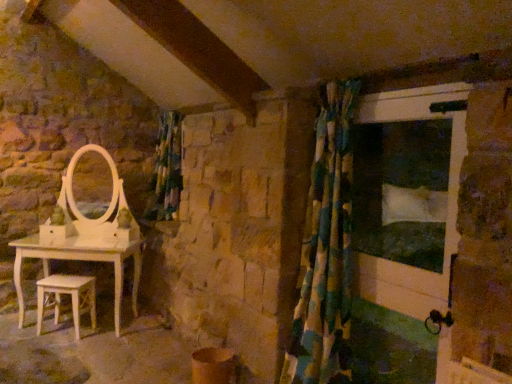
This screenshot has width=512, height=384. Describe the element at coordinates (404, 229) in the screenshot. I see `white painted wood screen door at right` at that location.

Image resolution: width=512 pixels, height=384 pixels. Find the location of `multicolored fabric shower curtain at right`. multicolored fabric shower curtain at right is located at coordinates (325, 246).

Measure the distance between white wooden stool at lower left and camera.

white wooden stool at lower left is 11.02 feet away from camera.

The image size is (512, 384). I want to click on white painted wood screen door at right, so click(x=404, y=229).

What's the angular difference between white wooden stool at lower left and white painted wood screen door at right's facing directions?

The angular difference between white wooden stool at lower left and white painted wood screen door at right is 48.2 degrees.

Is white wooden stool at lower left facing towards white painted wood screen door at right?

No, white wooden stool at lower left is not oriented towards white painted wood screen door at right.

Considering the sizes of white wooden stool at lower left and white painted wood screen door at right in the image, is white wooden stool at lower left wider or thinner than white painted wood screen door at right?

Clearly, white wooden stool at lower left has more width compared to white painted wood screen door at right.

Does white wooden stool at lower left have a smaller size compared to white painted wood screen door at right?

Yes, white wooden stool at lower left is smaller than white painted wood screen door at right.

Can you tell me how much green fabric curtain at center and white wooden stool at lower left differ in facing direction?

They differ by 48.5 degrees in their facing directions.

Between green fabric curtain at center and white wooden stool at lower left, which one has larger size?

green fabric curtain at center is bigger.

In the scene shown: Which is correct: green fabric curtain at center is inside white wooden stool at lower left, or outside of it?

green fabric curtain at center is not enclosed by white wooden stool at lower left.

Considering the relative sizes of green fabric curtain at center and white wooden stool at lower left in the image provided, is green fabric curtain at center wider than white wooden stool at lower left?

Yes.

In the image, is green fabric curtain at center on the left side or the right side of white painted wood screen door at right?

From the image, it's evident that green fabric curtain at center is to the left of white painted wood screen door at right.

Does green fabric curtain at center have a greater height compared to white painted wood screen door at right?

In fact, green fabric curtain at center may be shorter than white painted wood screen door at right.

Based on the photo, is green fabric curtain at center with white painted wood screen door at right?

No, green fabric curtain at center is not making contact with white painted wood screen door at right.

Does point (162, 167) appear closer or farther from the camera than point (433, 371)?

Clearly, point (162, 167) is more distant from the camera than point (433, 371).

Considering the relative positions of white wooden stool at lower left and green fabric curtain at center in the image provided, is white wooden stool at lower left to the left or to the right of green fabric curtain at center?

Based on their positions, white wooden stool at lower left is located to the left of green fabric curtain at center.

Which object is thinner, white wooden stool at lower left or green fabric curtain at center?

white wooden stool at lower left is thinner.

From a real-world perspective, is white wooden stool at lower left positioned under green fabric curtain at center based on gravity?

Indeed, from a real-world perspective, white wooden stool at lower left is positioned beneath green fabric curtain at center.

Considering the sizes of objects multicolored fabric shower curtain at right and green fabric curtain at center in the image provided, who is wider, multicolored fabric shower curtain at right or green fabric curtain at center?

multicolored fabric shower curtain at right.

Would you say multicolored fabric shower curtain at right contains green fabric curtain at center?

Actually, green fabric curtain at center is outside multicolored fabric shower curtain at right.

Is the depth of multicolored fabric shower curtain at right less than that of green fabric curtain at center?

Yes, multicolored fabric shower curtain at right is closer to the viewer.

You are a GUI agent. You are given a task and a screenshot of the screen. Output one action in this format:
    pyautogui.click(x=<x>, y=<y>)
    Task: Click on the curtain to the left of multicolored fabric shower curtain at right
    This screenshot has width=512, height=384.
    Given the screenshot: What is the action you would take?
    pyautogui.click(x=167, y=169)

I want to click on screen door that is above the white wooden stool at lower left (from a real-world perspective), so click(x=404, y=229).

Is point (354, 275) behind point (93, 323)?

No, (354, 275) is in front of (93, 323).

Is white painted wood screen door at right thinner than white wooden stool at lower left?

Indeed, white painted wood screen door at right has a lesser width compared to white wooden stool at lower left.

Can you confirm if white painted wood screen door at right is positioned to the right of green fabric curtain at center?

Indeed, white painted wood screen door at right is positioned on the right side of green fabric curtain at center.

Considering the sizes of objects white painted wood screen door at right and green fabric curtain at center in the image provided, who is wider, white painted wood screen door at right or green fabric curtain at center?

With larger width is green fabric curtain at center.

Considering the sizes of white painted wood screen door at right and green fabric curtain at center in the image, is white painted wood screen door at right taller or shorter than green fabric curtain at center?

white painted wood screen door at right is taller than green fabric curtain at center.

Could you tell me if white painted wood screen door at right is facing green fabric curtain at center?

No.

This screenshot has height=384, width=512. Find the location of `screen door that is in front of the white wooden stool at lower left`. screen door that is in front of the white wooden stool at lower left is located at coordinates (404, 229).

Find the location of a particular element. This screenshot has height=384, width=512. curtain behind the white wooden stool at lower left is located at coordinates (167, 169).

Estimate the real-world distances between objects in this image. Which object is further from multicolored fabric shower curtain at right, green fabric curtain at center or white wooden stool at lower left?

white wooden stool at lower left lies further to multicolored fabric shower curtain at right than the other object.

Looking at this image, estimate the real-world distances between objects in this image. Which object is further from multicolored fabric shower curtain at right, white wooden stool at lower left or white painted wood screen door at right?

The object further to multicolored fabric shower curtain at right is white wooden stool at lower left.

Based on their spatial positions, is multicolored fabric shower curtain at right or green fabric curtain at center further from white wooden stool at lower left?

The object further to white wooden stool at lower left is multicolored fabric shower curtain at right.

Estimate the real-world distances between objects in this image. Which object is further from multicolored fabric shower curtain at right, white painted wood screen door at right or green fabric curtain at center?

Based on the image, green fabric curtain at center appears to be further to multicolored fabric shower curtain at right.

Estimate the real-world distances between objects in this image. Which object is further from white painted wood screen door at right, white wooden stool at lower left or green fabric curtain at center?

white wooden stool at lower left is positioned further to the anchor white painted wood screen door at right.

Based on their spatial positions, is green fabric curtain at center or multicolored fabric shower curtain at right closer to white wooden stool at lower left?

green fabric curtain at center is positioned closer to the anchor white wooden stool at lower left.

When comparing their distances from white painted wood screen door at right, does multicolored fabric shower curtain at right or green fabric curtain at center seem further?

Based on the image, green fabric curtain at center appears to be further to white painted wood screen door at right.

Considering their positions, is white painted wood screen door at right positioned further to green fabric curtain at center than multicolored fabric shower curtain at right?

Based on the image, white painted wood screen door at right appears to be further to green fabric curtain at center.

Where is `shower curtain between white wooden stool at lower left and white painted wood screen door at right`? This screenshot has width=512, height=384. shower curtain between white wooden stool at lower left and white painted wood screen door at right is located at coordinates (325, 246).

Find the location of a particular element. This screenshot has height=384, width=512. curtain located between white wooden stool at lower left and white painted wood screen door at right in the left-right direction is located at coordinates (167, 169).

You are a GUI agent. You are given a task and a screenshot of the screen. Output one action in this format:
    pyautogui.click(x=<x>, y=<y>)
    Task: Click on the shower curtain located between white painted wood screen door at right and green fabric curtain at center in the depth direction
    Image resolution: width=512 pixels, height=384 pixels.
    Given the screenshot: What is the action you would take?
    pyautogui.click(x=325, y=246)

Where is `stool between multicolored fabric shower curtain at right and green fabric curtain at center along the z-axis`? The image size is (512, 384). stool between multicolored fabric shower curtain at right and green fabric curtain at center along the z-axis is located at coordinates (66, 294).